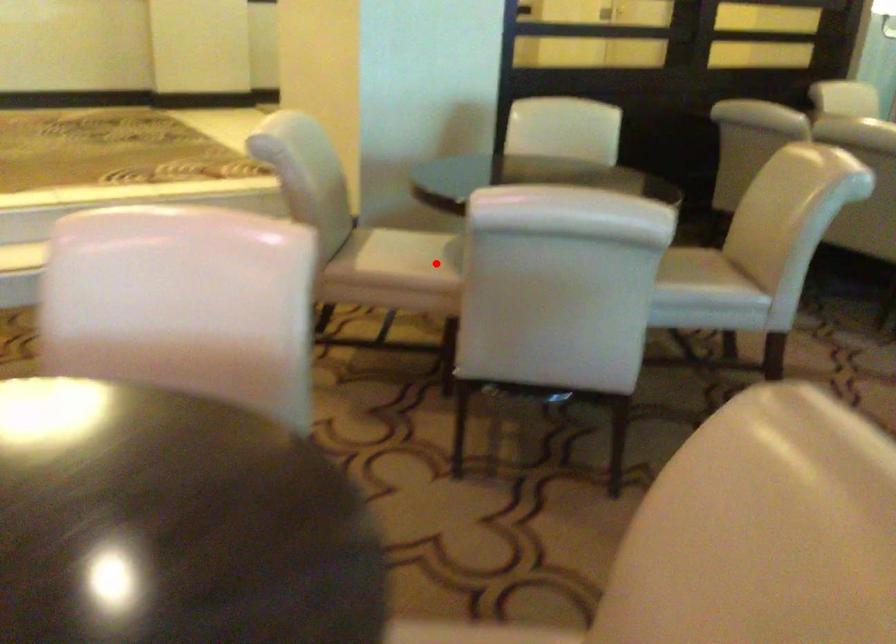
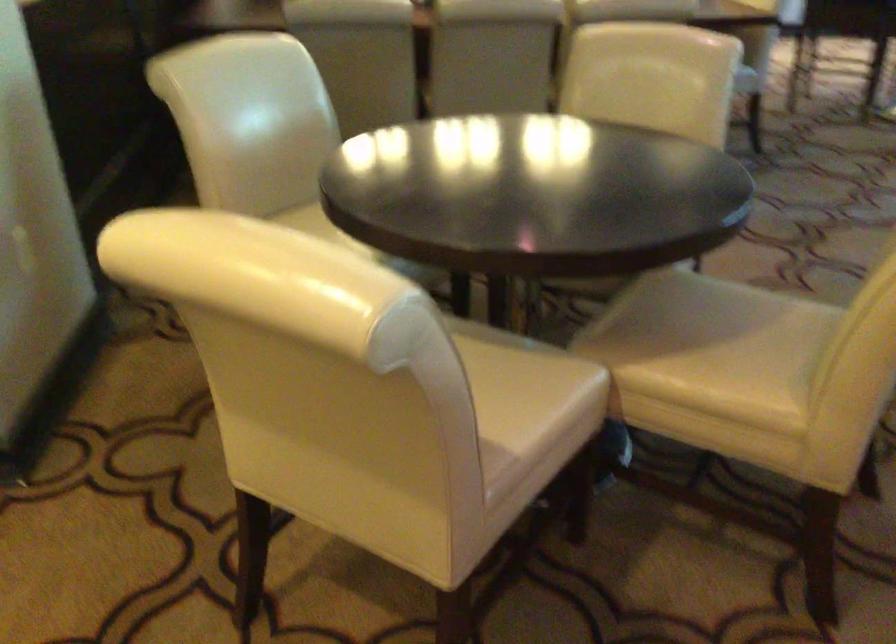
Find the pixel in the second image that matches the highlighted location in the first image.

(530, 377)